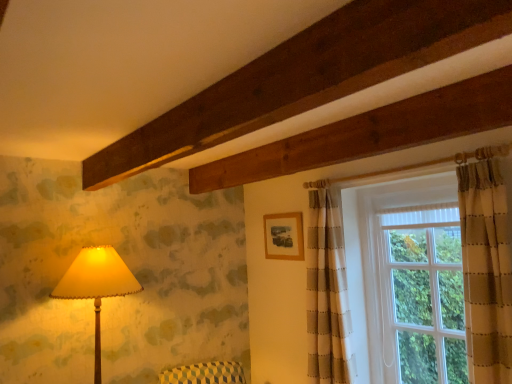
Identify the location of matte cream lampshade at left. (97, 285).

The height and width of the screenshot is (384, 512). Describe the element at coordinates (423, 294) in the screenshot. I see `clear glass window at right, arranged as the 2th window when viewed from the left` at that location.

From the picture: Measure the distance between point [284,216] and camera.

Point [284,216] and camera are 3.16 meters apart.

The image size is (512, 384). What are the coordinates of `white textured glass window at upper right, the 1th window positioned from the left` in the screenshot? It's located at (486, 265).

Which object is further away from the camera taking this photo, wooden frame at upper center or clear glass window at right, arranged as the 2th window when viewed from the left?

wooden frame at upper center is more distant.

Considering the sizes of objects wooden frame at upper center and clear glass window at right, the 1th window positioned from the right, in the image provided, who is bigger, wooden frame at upper center or clear glass window at right, the 1th window positioned from the right,?

clear glass window at right, the 1th window positioned from the right.

Is point (298, 250) farther from camera compared to point (408, 332)?

Yes.

Can you confirm if matte cream lampshade at left is thinner than clear glass window at right, arranged as the 2th window when viewed from the left?

Incorrect, the width of matte cream lampshade at left is not less than that of clear glass window at right, arranged as the 2th window when viewed from the left.

Is matte cream lampshade at left turned away from clear glass window at right, arranged as the 2th window when viewed from the left?

matte cream lampshade at left is not turned away from clear glass window at right, arranged as the 2th window when viewed from the left.

Is matte cream lampshade at left far from clear glass window at right, arranged as the 2th window when viewed from the left?

Yes, matte cream lampshade at left and clear glass window at right, arranged as the 2th window when viewed from the left, are located far from each other.

Is white textured glass window at upper right, which ranks as the second window in right-to-left order, in front of or behind wooden frame at upper center in the image?

white textured glass window at upper right, which ranks as the second window in right-to-left order, is in front of wooden frame at upper center.

From a real-world perspective, is white textured glass window at upper right, the 1th window positioned from the left, physically located above or below wooden frame at upper center?

From a real-world perspective, white textured glass window at upper right, the 1th window positioned from the left, is physically below wooden frame at upper center.

Considering the points (503, 378) and (298, 227), which point is in front, point (503, 378) or point (298, 227)?

The point (503, 378) is closer.

Is white textured glass window at upper right, the 1th window positioned from the left, facing towards matte cream lampshade at left?

No, white textured glass window at upper right, the 1th window positioned from the left, is not turned towards matte cream lampshade at left.

This screenshot has width=512, height=384. Find the location of `lamp below the white textured glass window at upper right, which ranks as the second window in right-to-left order (from the image's perspective)`. lamp below the white textured glass window at upper right, which ranks as the second window in right-to-left order (from the image's perspective) is located at coordinates (97, 285).

From the image's perspective, is white textured glass window at upper right, which ranks as the second window in right-to-left order, on top of matte cream lampshade at left?

Yes.

Considering the relative positions of clear glass window at right, arranged as the 2th window when viewed from the left, and white textured glass window at upper right, which ranks as the second window in right-to-left order, in the image provided, is clear glass window at right, arranged as the 2th window when viewed from the left, to the left or to the right of white textured glass window at upper right, which ranks as the second window in right-to-left order,?

In the image, clear glass window at right, arranged as the 2th window when viewed from the left, appears on the right side of white textured glass window at upper right, which ranks as the second window in right-to-left order.

Which object is further away from the camera taking this photo, clear glass window at right, the 1th window positioned from the right, or white textured glass window at upper right, which ranks as the second window in right-to-left order?

clear glass window at right, the 1th window positioned from the right.

In order to click on window located on the left of clear glass window at right, arranged as the 2th window when viewed from the left in this screenshot , I will do `click(486, 265)`.

Is the surface of clear glass window at right, the 1th window positioned from the right, in direct contact with white textured glass window at upper right, which ranks as the second window in right-to-left order?

No, clear glass window at right, the 1th window positioned from the right, is not with white textured glass window at upper right, which ranks as the second window in right-to-left order.

Considering the relative positions of wooden frame at upper center and matte cream lampshade at left in the image provided, is wooden frame at upper center to the left or to the right of matte cream lampshade at left?

wooden frame at upper center is to the right of matte cream lampshade at left.

In the scene shown: Is matte cream lampshade at left located within wooden frame at upper center?

No, matte cream lampshade at left is not surrounded by wooden frame at upper center.

Considering the positions of point (270, 254) and point (104, 287), is point (270, 254) closer or farther from the camera than point (104, 287)?

Clearly, point (270, 254) is more distant from the camera than point (104, 287).

Is wooden frame at upper center taller or shorter than matte cream lampshade at left?

Clearly, wooden frame at upper center is shorter compared to matte cream lampshade at left.

How different are the orientations of matte cream lampshade at left and white textured glass window at upper right, the 1th window positioned from the left, in degrees?

They differ by 91.1 degrees in their facing directions.

From a real-world perspective, is matte cream lampshade at left physically below white textured glass window at upper right, which ranks as the second window in right-to-left order?

Yes, from a real-world perspective, matte cream lampshade at left is beneath white textured glass window at upper right, which ranks as the second window in right-to-left order.

Is matte cream lampshade at left not near white textured glass window at upper right, which ranks as the second window in right-to-left order?

Yes.

From the picture: Considering the relative sizes of matte cream lampshade at left and white textured glass window at upper right, the 1th window positioned from the left, in the image provided, is matte cream lampshade at left thinner than white textured glass window at upper right, the 1th window positioned from the left,?

No, matte cream lampshade at left is not thinner than white textured glass window at upper right, the 1th window positioned from the left.

In order to click on the 2nd window below when counting from the wooden frame at upper center (from the image's perspective) in this screenshot , I will do `click(423, 294)`.

Where is `the 1st window above the matte cream lampshade at left (from the image's perspective)`? The image size is (512, 384). the 1st window above the matte cream lampshade at left (from the image's perspective) is located at coordinates (423, 294).

From the image, which object appears to be nearer to matte cream lampshade at left, wooden frame at upper center or clear glass window at right, the 1th window positioned from the right?

Based on the image, wooden frame at upper center appears to be nearer to matte cream lampshade at left.

Based on their spatial positions, is white textured glass window at upper right, which ranks as the second window in right-to-left order, or clear glass window at right, the 1th window positioned from the right, closer to matte cream lampshade at left?

white textured glass window at upper right, which ranks as the second window in right-to-left order, is positioned closer to the anchor matte cream lampshade at left.

Considering their positions, is clear glass window at right, the 1th window positioned from the right, positioned further to white textured glass window at upper right, the 1th window positioned from the left, than matte cream lampshade at left?

matte cream lampshade at left is positioned further to the anchor white textured glass window at upper right, the 1th window positioned from the left.

Considering their positions, is wooden frame at upper center positioned closer to clear glass window at right, arranged as the 2th window when viewed from the left, than white textured glass window at upper right, the 1th window positioned from the left?

Among the two, white textured glass window at upper right, the 1th window positioned from the left, is located nearer to clear glass window at right, arranged as the 2th window when viewed from the left.

Looking at the image, which one is located closer to clear glass window at right, the 1th window positioned from the right, matte cream lampshade at left or white textured glass window at upper right, the 1th window positioned from the left?

Among the two, white textured glass window at upper right, the 1th window positioned from the left, is located nearer to clear glass window at right, the 1th window positioned from the right.

When comparing their distances from matte cream lampshade at left, does clear glass window at right, arranged as the 2th window when viewed from the left, or wooden frame at upper center seem closer?

Based on the image, wooden frame at upper center appears to be nearer to matte cream lampshade at left.

Looking at the image, which one is located further to wooden frame at upper center, clear glass window at right, the 1th window positioned from the right, or matte cream lampshade at left?

The object further to wooden frame at upper center is matte cream lampshade at left.

Looking at this image, when comparing their distances from clear glass window at right, the 1th window positioned from the right, does wooden frame at upper center or matte cream lampshade at left seem further?

matte cream lampshade at left.

Where is `window located between white textured glass window at upper right, which ranks as the second window in right-to-left order, and wooden frame at upper center in the depth direction`? Image resolution: width=512 pixels, height=384 pixels. window located between white textured glass window at upper right, which ranks as the second window in right-to-left order, and wooden frame at upper center in the depth direction is located at coordinates (423, 294).

This screenshot has width=512, height=384. I want to click on window located between matte cream lampshade at left and clear glass window at right, arranged as the 2th window when viewed from the left, in the left-right direction, so click(x=486, y=265).

Identify the location of picture frame between matte cream lampshade at left and clear glass window at right, the 1th window positioned from the right. (284, 236).

I want to click on picture frame between matte cream lampshade at left and white textured glass window at upper right, the 1th window positioned from the left, in the horizontal direction, so click(x=284, y=236).